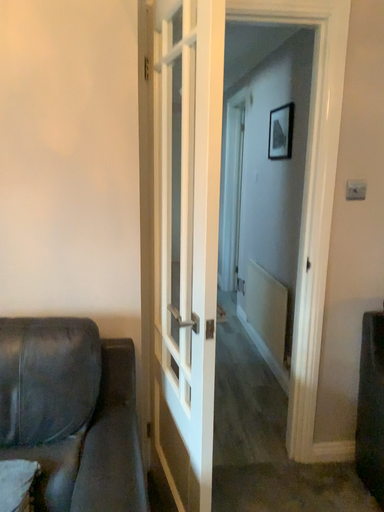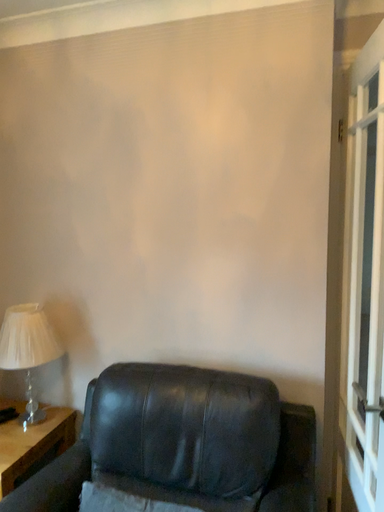
Question: How did the camera likely rotate when shooting the video?

Choices:
 (A) rotated right
 (B) rotated left

Answer: (B)